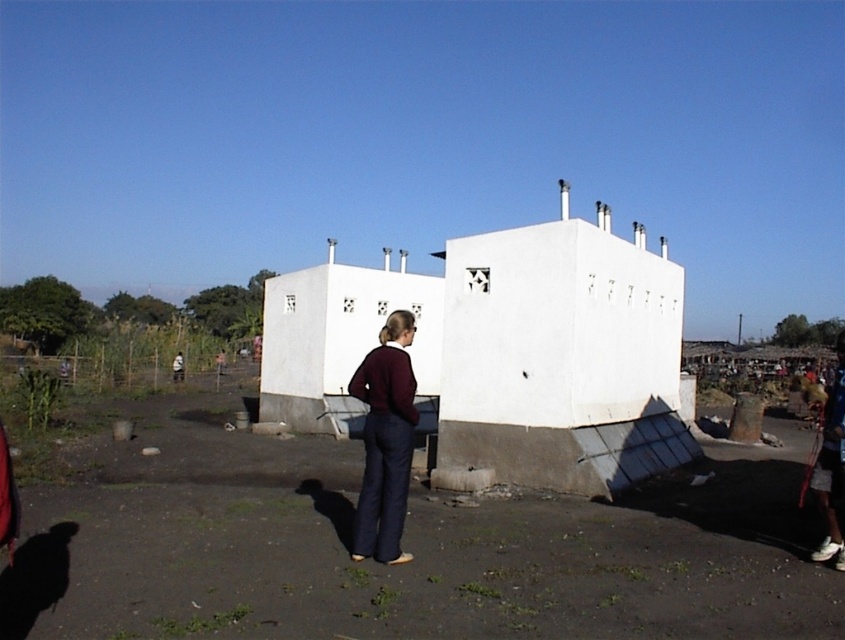
Question: From the image, what is the correct spatial relationship of dirt field at lower center in relation to brown leather jacket at center?

Choices:
 (A) left
 (B) right

Answer: (B)

Question: Which is nearer to the maroon sweater at center?

Choices:
 (A) brown leather jacket at center
 (B) dirt field at lower center

Answer: (B)

Question: Among these objects, which one is farthest from the camera?

Choices:
 (A) dirt field at lower center
 (B) brown leather jacket at center

Answer: (B)

Question: Does maroon sweater at center appear on the right side of brown leather jacket at center?

Choices:
 (A) yes
 (B) no

Answer: (A)

Question: Which is nearer to the maroon sweater at center?

Choices:
 (A) dirt field at lower center
 (B) brown leather jacket at center

Answer: (A)

Question: Does dirt field at lower center have a smaller size compared to maroon sweater at center?

Choices:
 (A) yes
 (B) no

Answer: (B)